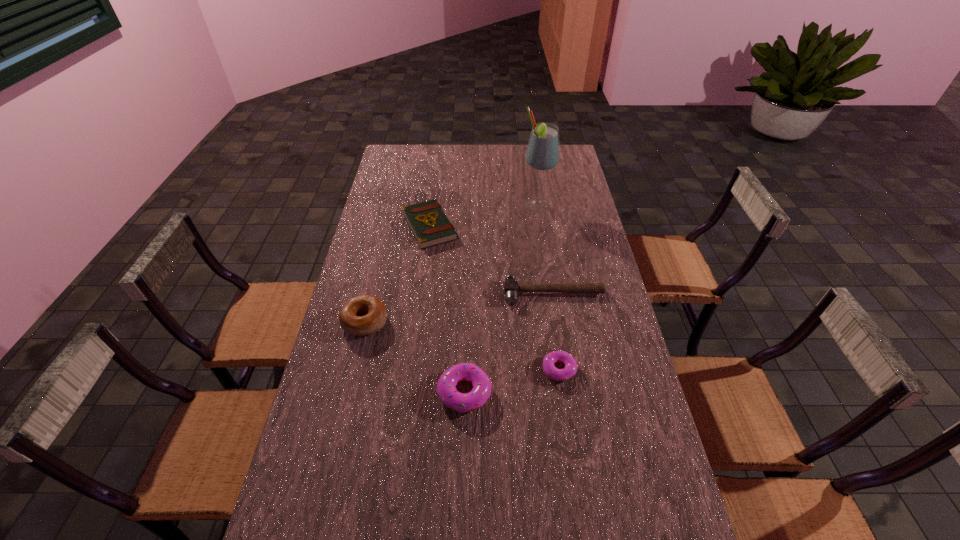
Please point a vacant point for placing a doughnut on the left. Please provide its 2D coordinates. Your answer should be formatted as a tuple, i.e. [(x, y)], where the tuple contains the x and y coordinates of a point satisfying the conditions above.

[(361, 417)]